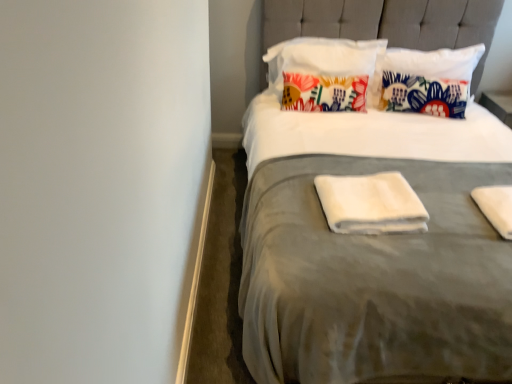
Question: Is floral fabric pillow at upper center, acting as the 2th pillow starting from the left, spatially inside floral fabric pillow at upper center, marked as the 1th pillow in a left-to-right arrangement, or outside of it?

Choices:
 (A) inside
 (B) outside

Answer: (B)

Question: Based on their sizes in the image, would you say floral fabric pillow at upper center, acting as the 2th pillow starting from the left, is bigger or smaller than floral fabric pillow at upper center, marked as the 2th pillow in a right-to-left arrangement?

Choices:
 (A) big
 (B) small

Answer: (A)

Question: Estimate the real-world distances between objects in this image. Which object is farther from the floral fabric pillow at upper center, which ranks as the 1th pillow in right-to-left order?

Choices:
 (A) white soft towel at right, the 2th material in the left-to-right sequence
 (B) floral fabric pillow at upper center, marked as the 1th pillow in a left-to-right arrangement
 (C) white soft towel at center, arranged as the second material when viewed from the right
 (D) suede gray bed at center

Answer: (C)

Question: Based on their relative distances, which object is farther from the floral fabric pillow at upper center, acting as the 2th pillow starting from the left?

Choices:
 (A) white soft towel at center, the first material when ordered from left to right
 (B) suede gray bed at center
 (C) floral fabric pillow at upper center, marked as the 2th pillow in a right-to-left arrangement
 (D) white soft towel at right, the 2th material in the left-to-right sequence

Answer: (A)